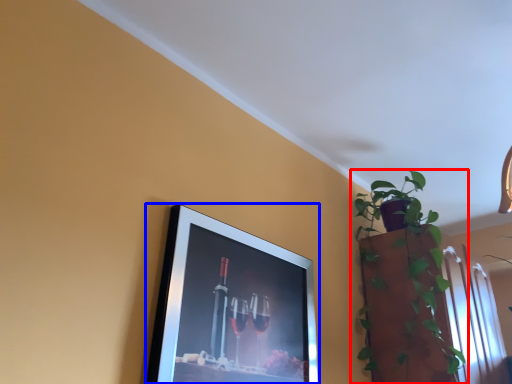
Question: Which point is further to the camera, houseplant (highlighted by a red box) or picture frame (highlighted by a blue box)?

Choices:
 (A) houseplant
 (B) picture frame

Answer: (A)